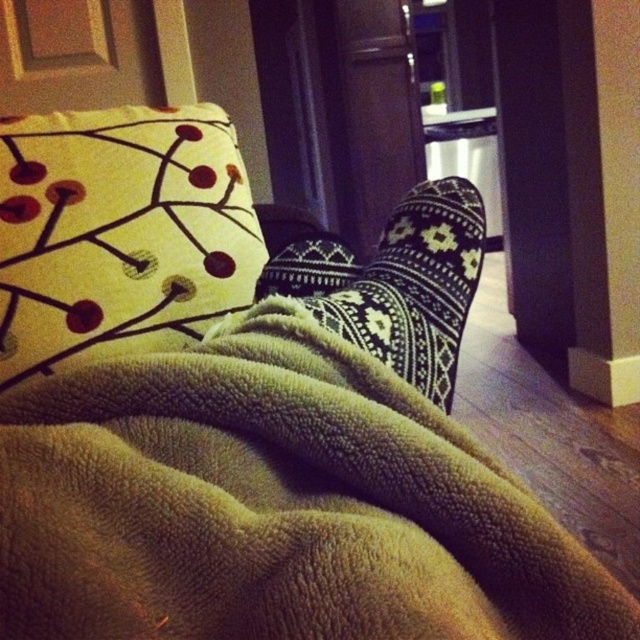
Identify the location of green fleece blanket at lower center. The image size is (640, 640). (275, 506).

This screenshot has height=640, width=640. Describe the element at coordinates (275, 506) in the screenshot. I see `green fleece blanket at lower center` at that location.

Where is `green fleece blanket at lower center`? green fleece blanket at lower center is located at coordinates (275, 506).

You are a GUI agent. You are given a task and a screenshot of the screen. Output one action in this format:
    pyautogui.click(x=<x>, y=<y>)
    Task: Click on the yellow fabric pillow at upper left
    The height and width of the screenshot is (640, 640).
    Given the screenshot: What is the action you would take?
    pyautogui.click(x=120, y=234)

Can you confirm if yellow fabric pillow at upper left is thinner than black knitted socks at center?

No.

Is point (29, 340) closer to viewer compared to point (372, 353)?

No, it is not.

The height and width of the screenshot is (640, 640). In order to click on yellow fabric pillow at upper left in this screenshot , I will do 120,234.

Does green fleece blanket at lower center appear on the right side of black knitted socks at center?

No, green fleece blanket at lower center is not to the right of black knitted socks at center.

Is green fleece blanket at lower center above black knitted socks at center?

Incorrect, green fleece blanket at lower center is not positioned above black knitted socks at center.

The width and height of the screenshot is (640, 640). I want to click on green fleece blanket at lower center, so click(275, 506).